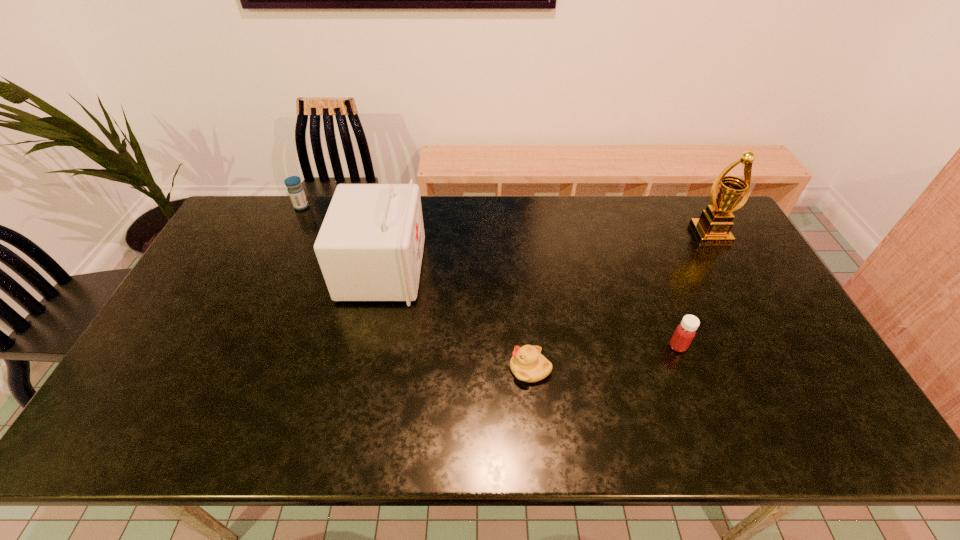
Find the location of `the rightmost object`. the rightmost object is located at coordinates (713, 227).

Where is `the first-aid kit`? the first-aid kit is located at coordinates (370, 246).

Image resolution: width=960 pixels, height=540 pixels. I want to click on the farther medicine, so click(296, 192).

What are the coordinates of `the farthest object` in the screenshot? It's located at (296, 192).

Locate an element on the screen. The image size is (960, 540). the second object from right to left is located at coordinates (685, 332).

What are the coordinates of `the nearer medicine` in the screenshot? It's located at pos(685,332).

Locate an element on the screen. duckling is located at coordinates (527, 364).

You are a GUI agent. You are given a task and a screenshot of the screen. Output one action in this format:
    pyautogui.click(x=<x>, y=<y>)
    Task: Click on the shortest object
    The width and height of the screenshot is (960, 540).
    Given the screenshot: What is the action you would take?
    pyautogui.click(x=527, y=364)

Find the location of a particular element. This screenshot has width=960, height=540. vacant space located on the front-facing side of the award is located at coordinates (731, 271).

Image resolution: width=960 pixels, height=540 pixels. What are the coordinates of `vacant space located on the front-facing side of the first-aid kit` in the screenshot? It's located at (543, 270).